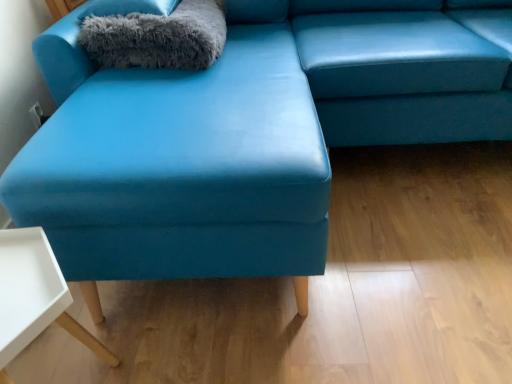
Where is `white matte table at lower left`? This screenshot has height=384, width=512. white matte table at lower left is located at coordinates (34, 296).

The width and height of the screenshot is (512, 384). Describe the element at coordinates (34, 296) in the screenshot. I see `white matte table at lower left` at that location.

In order to click on gray fluffy blanket at upper left in this screenshot , I will do `click(157, 37)`.

This screenshot has width=512, height=384. What do you see at coordinates (157, 37) in the screenshot?
I see `gray fluffy blanket at upper left` at bounding box center [157, 37].

Describe the element at coordinates (130, 7) in the screenshot. Image resolution: width=512 pixels, height=384 pixels. I see `gray fluffy pillow at upper left` at that location.

The height and width of the screenshot is (384, 512). I want to click on white matte table at lower left, so click(x=34, y=296).

Is matte blue cushion at center outside of gray fluffy blanket at upper left?

Yes, matte blue cushion at center is outside of gray fluffy blanket at upper left.

Can you confirm if matte blue cushion at center is bigger than gray fluffy blanket at upper left?

Yes, matte blue cushion at center is bigger than gray fluffy blanket at upper left.

From a real-world perspective, is matte blue cushion at center physically above gray fluffy blanket at upper left?

Incorrect, from a real-world perspective, matte blue cushion at center is lower than gray fluffy blanket at upper left.

Which is behind, point (312, 70) or point (168, 52)?

The point (312, 70) is more distant.

Between point (40, 306) and point (96, 10), which one is positioned behind?

The point (96, 10) is behind.

Is white matte table at lower left in contact with gray fluffy pillow at upper left?

They are not placed beside each other.

Looking at this image, which of these two, white matte table at lower left or gray fluffy pillow at upper left, stands shorter?

gray fluffy pillow at upper left is shorter.

Between gray fluffy pillow at upper left and gray fluffy blanket at upper left, which one has smaller width?

With smaller width is gray fluffy pillow at upper left.

Does gray fluffy pillow at upper left appear on the right side of gray fluffy blanket at upper left?

In fact, gray fluffy pillow at upper left is to the left of gray fluffy blanket at upper left.

Considering the relative sizes of gray fluffy pillow at upper left and gray fluffy blanket at upper left in the image provided, is gray fluffy pillow at upper left smaller than gray fluffy blanket at upper left?

Indeed, gray fluffy pillow at upper left has a smaller size compared to gray fluffy blanket at upper left.

Is gray fluffy pillow at upper left placed right next to gray fluffy blanket at upper left?

Yes, gray fluffy pillow at upper left is in contact with gray fluffy blanket at upper left.

Is gray fluffy blanket at upper left in front of or behind white matte table at lower left in the image?

Visually, gray fluffy blanket at upper left is located behind white matte table at lower left.

From the image's perspective, between gray fluffy blanket at upper left and white matte table at lower left, which one is located above?

gray fluffy blanket at upper left, from the image's perspective.

Which point is more forward, (x=182, y=34) or (x=10, y=322)?

Point (x=10, y=322)

Can you tell me how much gray fluffy blanket at upper left and white matte table at lower left differ in facing direction?

Result: 85.7 degrees separate the facing orientations of gray fluffy blanket at upper left and white matte table at lower left.

Identify the location of swivel chair located underneath the gray fluffy pillow at upper left (from a real-world perspective). (x=400, y=73).

Does point (170, 3) lie in front of point (409, 46)?

Yes, point (170, 3) is in front of point (409, 46).

From the picture: From a real-world perspective, which is physically above, gray fluffy pillow at upper left or matte blue cushion at center?

gray fluffy pillow at upper left, from a real-world perspective.

Who is bigger, gray fluffy pillow at upper left or matte blue cushion at center?

With larger size is matte blue cushion at center.

Can you tell me how much gray fluffy pillow at upper left and white matte table at lower left differ in facing direction?

gray fluffy pillow at upper left and white matte table at lower left are facing 87 degrees away from each other.

Consider the image. Looking at the image, does gray fluffy pillow at upper left seem bigger or smaller compared to white matte table at lower left?

Clearly, gray fluffy pillow at upper left is smaller in size than white matte table at lower left.

Can you confirm if gray fluffy pillow at upper left is shorter than white matte table at lower left?

Correct, gray fluffy pillow at upper left is not as tall as white matte table at lower left.

From a real-world perspective, is gray fluffy blanket at upper left positioned over matte blue cushion at center based on gravity?

Yes.

Which of these two, gray fluffy blanket at upper left or matte blue cushion at center, is smaller?

With smaller size is gray fluffy blanket at upper left.

Could you tell me if gray fluffy blanket at upper left is facing matte blue cushion at center?

No.

Looking at this image, between gray fluffy blanket at upper left and matte blue cushion at center, which one is positioned behind?

Positioned behind is gray fluffy blanket at upper left.

Find the location of a particular element. swivel chair located below the gray fluffy blanket at upper left (from the image's perspective) is located at coordinates [x=400, y=73].

Find the location of a particular element. This screenshot has width=512, height=384. pillow on the right of white matte table at lower left is located at coordinates (130, 7).

In the scene shown: From the image, which object appears to be farther from gray fluffy blanket at upper left, matte blue cushion at center or white matte table at lower left?

white matte table at lower left.

Estimate the real-world distances between objects in this image. Which object is further from gray fluffy blanket at upper left, gray fluffy pillow at upper left or matte blue cushion at center?

matte blue cushion at center lies further to gray fluffy blanket at upper left than the other object.

When comparing their distances from gray fluffy pillow at upper left, does gray fluffy blanket at upper left or matte blue cushion at center seem closer?

Based on the image, gray fluffy blanket at upper left appears to be nearer to gray fluffy pillow at upper left.

From the image, which object appears to be nearer to gray fluffy blanket at upper left, white matte table at lower left or matte blue cushion at center?

matte blue cushion at center is closer to gray fluffy blanket at upper left.

From the image, which object appears to be farther from white matte table at lower left, matte blue cushion at center or gray fluffy blanket at upper left?

matte blue cushion at center lies further to white matte table at lower left than the other object.

Based on their spatial positions, is gray fluffy blanket at upper left or gray fluffy pillow at upper left further from white matte table at lower left?

gray fluffy pillow at upper left.

Which object lies further to the anchor point gray fluffy pillow at upper left, matte blue cushion at center or white matte table at lower left?

white matte table at lower left is positioned further to the anchor gray fluffy pillow at upper left.

From the image, which object appears to be nearer to matte blue cushion at center, gray fluffy pillow at upper left or gray fluffy blanket at upper left?

Among the two, gray fluffy blanket at upper left is located nearer to matte blue cushion at center.

Where is `pillow between white matte table at lower left and matte blue cushion at center`? pillow between white matte table at lower left and matte blue cushion at center is located at coordinates (x=130, y=7).

Find the location of a particular element. The height and width of the screenshot is (384, 512). blanket between white matte table at lower left and matte blue cushion at center is located at coordinates (157, 37).

Locate an element on the screen. Image resolution: width=512 pixels, height=384 pixels. blanket located between gray fluffy pillow at upper left and matte blue cushion at center in the left-right direction is located at coordinates (157, 37).

Find the location of `blanket between gray fluffy pillow at upper left and white matte table at lower left from top to bottom`. blanket between gray fluffy pillow at upper left and white matte table at lower left from top to bottom is located at coordinates (157, 37).